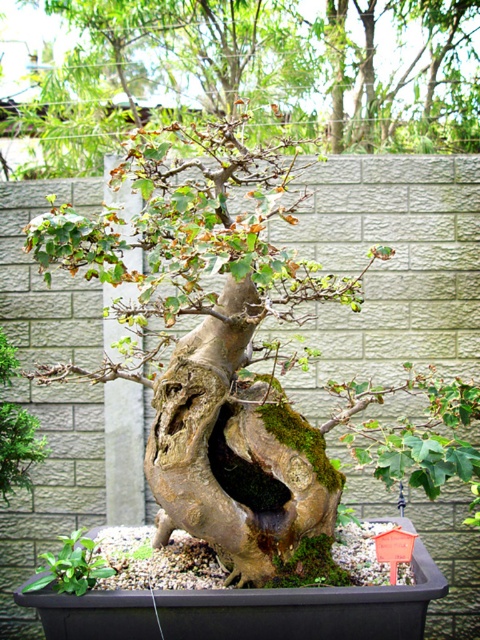
You are a gardener inspecting the bonsai arrangement. You notice the green mossy tree trunk at center and the green mossy rock at lower left. Which object is located to the right of the other?

The green mossy tree trunk at center is positioned on the right side of green mossy rock at lower left.

You are standing in front of the bonsai tree and want to take a photo. There are two points on the bonsai tree marked as point 1 at coordinates (351,113) and point 2 at coordinates (45,582). If you want to focus on the part of the tree closest to you, which point should you aim your camera at?

Point 2 at coordinates (45,582) is closer to you than point 1 at coordinates (351,113), so you should aim your camera at point 2 to focus on the closest part of the tree.

You are a gardener standing in front of the bonsai tree. You want to water the green mossy rock at lower left without getting the green mossy tree trunk at center wet. Is this possible given their positions?

The green mossy tree trunk at center is further to the viewer than the green mossy rock at lower left, so you can water the green mossy rock at lower left without getting the trunk wet by approaching from behind the trunk.